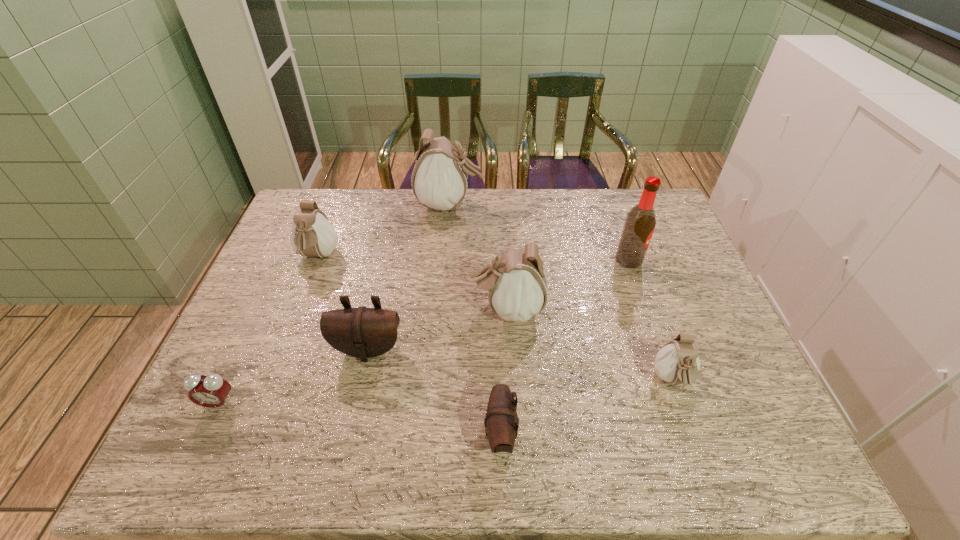
Point out which pouch is positioned as the nearest to the leftmost pouch. Please provide its 2D coordinates. Your answer should be formatted as a tuple, i.e. [(x, y)], where the tuple contains the x and y coordinates of a point satisfying the conditions above.

[(439, 180)]

Point out which pouch is positioned as the fourth nearest to the farther brown pouch. Please provide its 2D coordinates. Your answer should be formatted as a tuple, i.e. [(x, y)], where the tuple contains the x and y coordinates of a point satisfying the conditions above.

[(439, 180)]

I want to click on the third closest white pouch to the right brown pouch, so click(312, 235).

Identify which white pouch is located as the nearest to the smallest white pouch. Please provide its 2D coordinates. Your answer should be formatted as a tuple, i.e. [(x, y)], where the tuple contains the x and y coordinates of a point satisfying the conditions above.

[(516, 282)]

At what (x,y) coordinates should I click in order to perform the action: click on free spot that satisfies the following two spatial constraints: 1. on the front side of the beer bottle; 2. with the flap open on the nearer brown pouch. Please return your answer as a coordinate pair (x, y). Image resolution: width=960 pixels, height=540 pixels. Looking at the image, I should click on point(689,434).

The height and width of the screenshot is (540, 960). What are the coordinates of `blank area in the image that satisfies the following two spatial constraints: 1. on the front-facing side of the tallest pouch; 2. on the front-facing side of the second farthest pouch` in the screenshot? It's located at (445, 256).

Find the location of a particular element. This screenshot has width=960, height=540. free space that satisfies the following two spatial constraints: 1. on the front-facing side of the beer bottle; 2. on the right side of the farthest pouch is located at coordinates (445, 260).

This screenshot has width=960, height=540. I want to click on free spot that satisfies the following two spatial constraints: 1. on the front-facing side of the sixth shortest object; 2. with the flap open on the left brown pouch, so click(x=510, y=349).